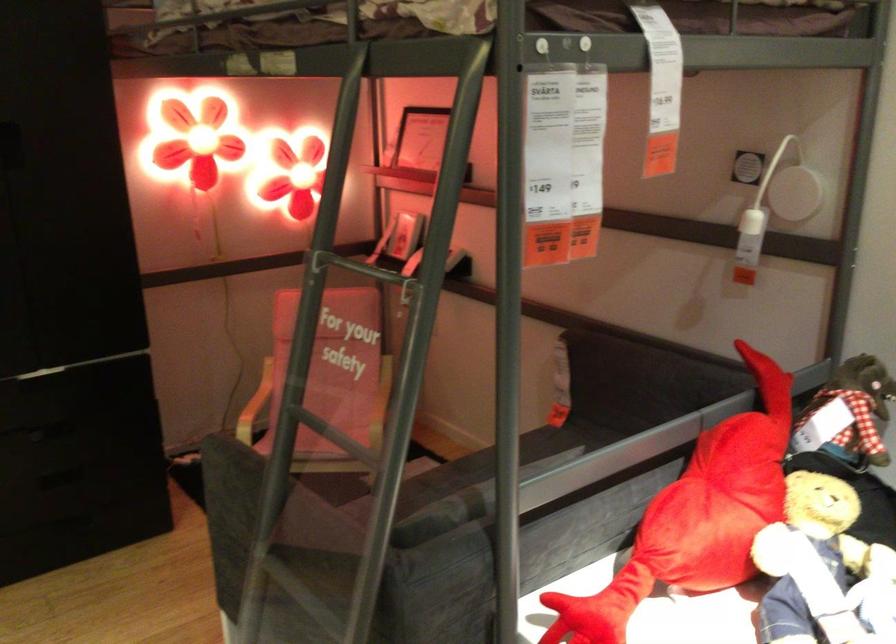
Identify the location of white lamp switch. The width and height of the screenshot is (896, 644). (751, 236).